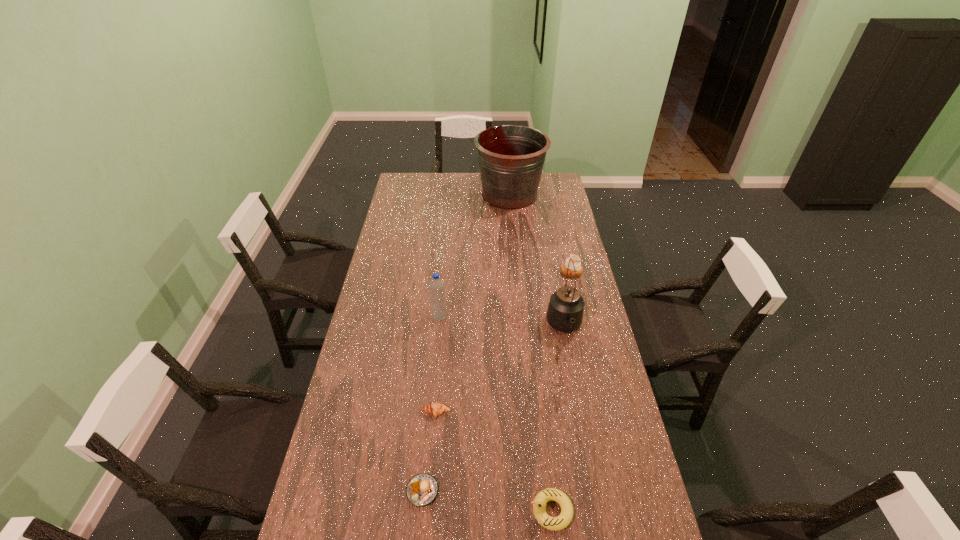
Where is `bucket`? This screenshot has height=540, width=960. bucket is located at coordinates (511, 157).

Find the location of a particular element. kettle is located at coordinates (565, 311).

What are the coordinates of `the third tallest object` in the screenshot? It's located at (436, 285).

Where is `the tallest pastry`? the tallest pastry is located at coordinates (576, 259).

Locate an element on the screen. This screenshot has height=540, width=960. the second farthest object is located at coordinates (576, 259).

Where is `duckling`? This screenshot has width=960, height=540. duckling is located at coordinates (560, 522).

The width and height of the screenshot is (960, 540). What are the coordinates of `the second farthest pastry` in the screenshot? It's located at (435, 409).

Identify the location of the nearest pastry. (422, 489).

The width and height of the screenshot is (960, 540). Find the location of `vacant region located on the front of the farthest object`. vacant region located on the front of the farthest object is located at coordinates (513, 224).

Identify the location of vacant point located spout on the kettle. (576, 389).